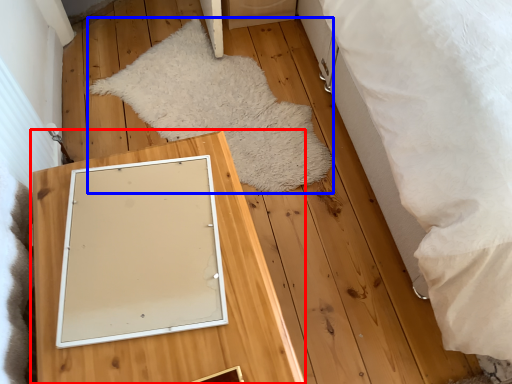
Question: Which object is further to the camera taking this photo, furniture (highlighted by a red box) or blanket (highlighted by a blue box)?

Choices:
 (A) furniture
 (B) blanket

Answer: (B)